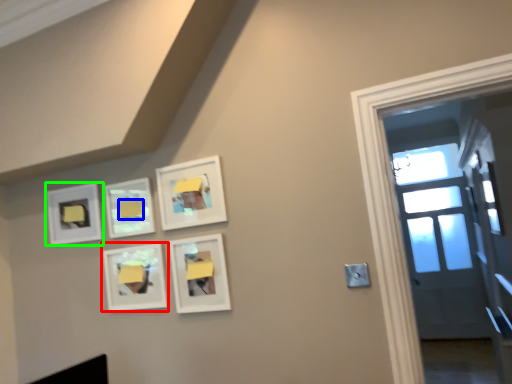
Question: Which object is the farthest from picture frame (highlighted by a red box)? Choose among these: lift (highlighted by a blue box) or picture frame (highlighted by a green box).

Choices:
 (A) lift
 (B) picture frame

Answer: (B)